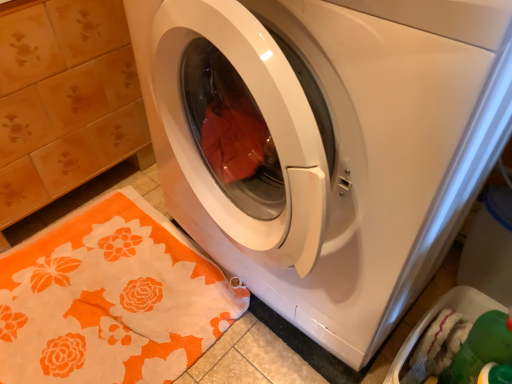
Question: Does white glossy washing machine at center have a greater width compared to orange floral rug at lower left?

Choices:
 (A) no
 (B) yes

Answer: (A)

Question: Considering the relative sizes of white glossy washing machine at center and orange floral rug at lower left in the image provided, is white glossy washing machine at center taller than orange floral rug at lower left?

Choices:
 (A) no
 (B) yes

Answer: (B)

Question: From a real-world perspective, is white glossy washing machine at center physically below orange floral rug at lower left?

Choices:
 (A) yes
 (B) no

Answer: (B)

Question: Considering the relative sizes of white glossy washing machine at center and orange floral rug at lower left in the image provided, is white glossy washing machine at center shorter than orange floral rug at lower left?

Choices:
 (A) yes
 (B) no

Answer: (B)

Question: Is white glossy washing machine at center placed right next to orange floral rug at lower left?

Choices:
 (A) yes
 (B) no

Answer: (B)

Question: Is white glossy washing machine at center facing away from orange floral rug at lower left?

Choices:
 (A) no
 (B) yes

Answer: (A)

Question: Is there a large distance between green plastic dish washer at lower right and white glossy washing machine at center?

Choices:
 (A) no
 (B) yes

Answer: (A)

Question: From the image's perspective, is green plastic dish washer at lower right below white glossy washing machine at center?

Choices:
 (A) no
 (B) yes

Answer: (B)

Question: Does green plastic dish washer at lower right have a smaller size compared to white glossy washing machine at center?

Choices:
 (A) no
 (B) yes

Answer: (B)

Question: From a real-world perspective, does green plastic dish washer at lower right sit lower than white glossy washing machine at center?

Choices:
 (A) yes
 (B) no

Answer: (A)

Question: Is white glossy washing machine at center a part of green plastic dish washer at lower right?

Choices:
 (A) yes
 (B) no

Answer: (B)

Question: Is green plastic dish washer at lower right to the right of white glossy washing machine at center from the viewer's perspective?

Choices:
 (A) yes
 (B) no

Answer: (A)

Question: From a real-world perspective, is orange floral rug at lower left positioned under green plastic dish washer at lower right based on gravity?

Choices:
 (A) no
 (B) yes

Answer: (B)